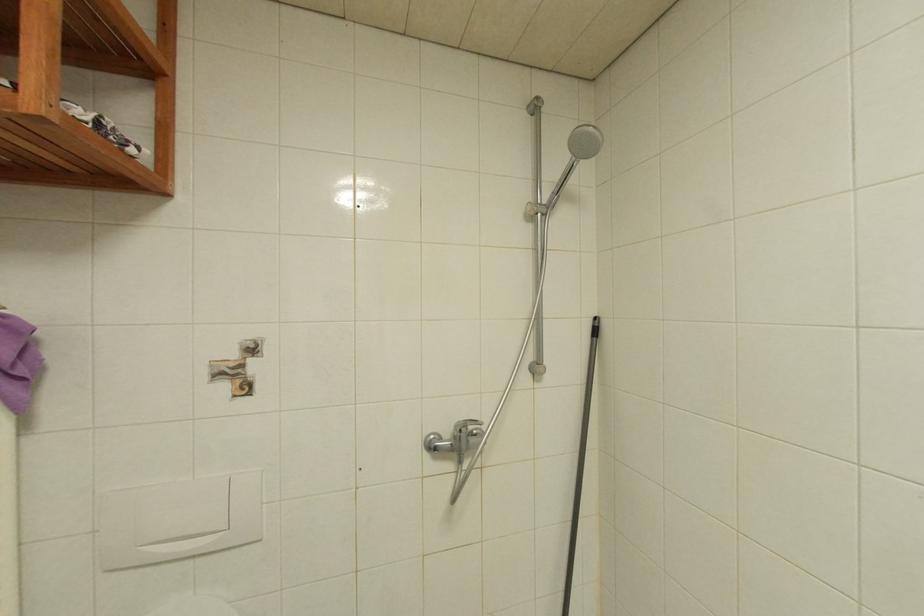
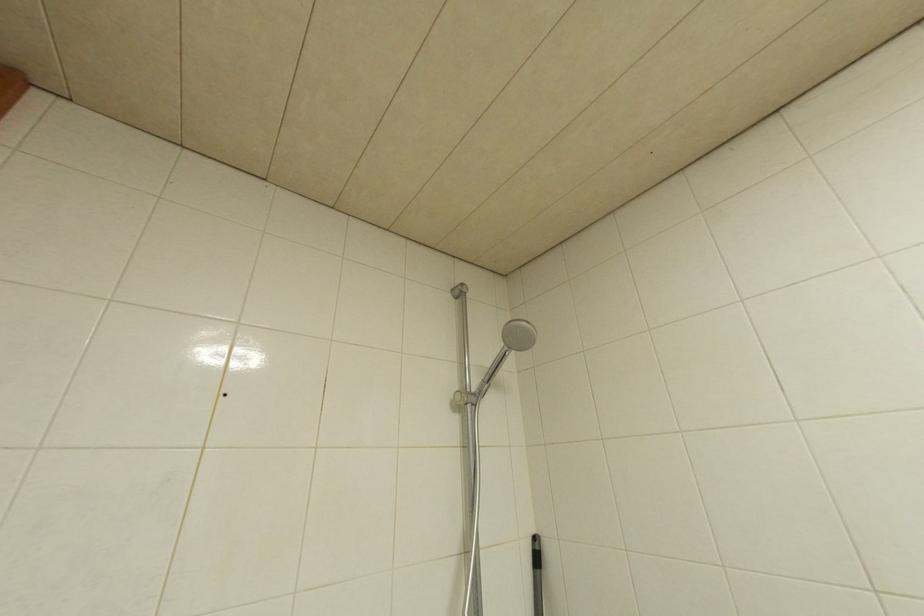
The first image is from the beginning of the video and the second image is from the end. How did the camera likely rotate when shooting the video?

The camera rotated toward right-up.